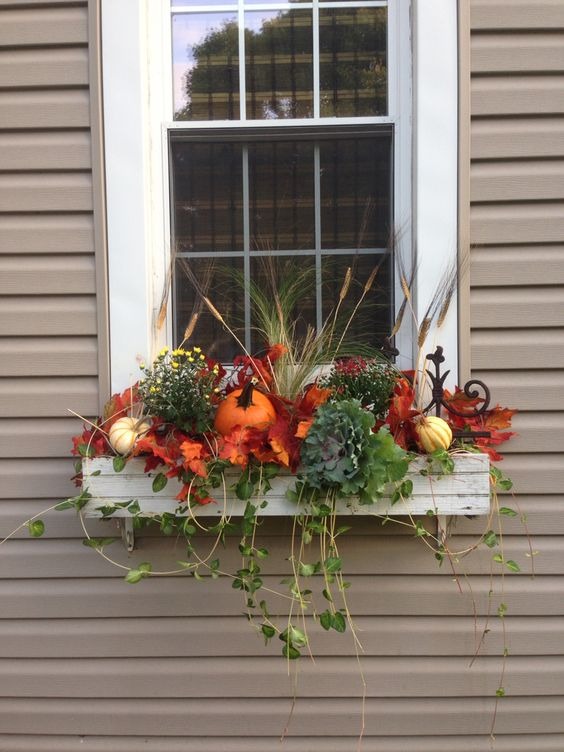
Find the location of a particular element. Image resolution: width=564 pixels, height=752 pixels. window frame is located at coordinates pyautogui.click(x=122, y=123), pyautogui.click(x=437, y=144).